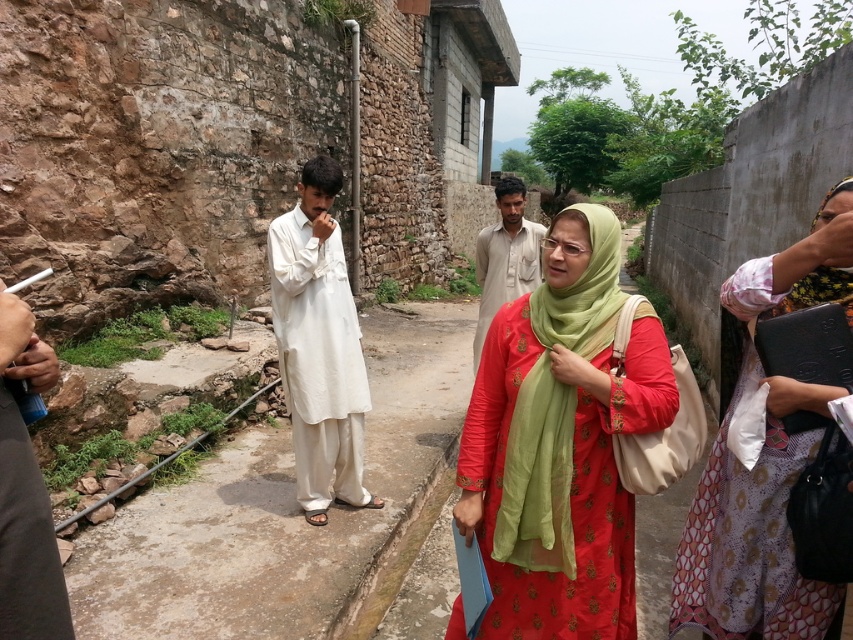
You are a photographer trying to capture a group photo of two people wearing the white cotton shirt at center and the patterned fabric dress at right. Based on their positions, which person should stand on the left side of the photo to maintain their current spatial arrangement?

The white cotton shirt at center should be on the left side of the photo because it is already positioned to the left of the patterned fabric dress at right.

You are a photographer standing in the scene. You want to capture a photo that includes both the matte red dress at center and the white cotton kurta at center. The camera you are using has a maximum focus range of 1.5 meters. Will both subjects be in focus if you position yourself exactly between them?

The distance between the matte red dress at center and the white cotton kurta at center is 1.49 meters, which is within the camera maximum focus range of 1.5 meters. Therefore, both subjects will be in focus.

You are a delivery person who needs to place a metallic blue can at left near the matte red dress at center. Can you safely place it within 4 feet of the dress?

The distance between the matte red dress at center and metallic blue can at left is 3.99 feet, so yes, you can safely place it within 4 feet of the dress.